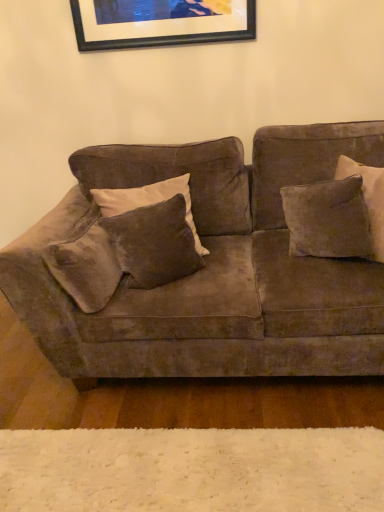
This screenshot has width=384, height=512. What do you see at coordinates (328, 219) in the screenshot? I see `velvet brown pillow at right, which is the first pillow in right-to-left order` at bounding box center [328, 219].

In order to face white fluffy rug at lower center, should I rotate leftwards or rightwards?

It's best to rotate left around 1.515 degrees.

This screenshot has width=384, height=512. Describe the element at coordinates (215, 269) in the screenshot. I see `velvet brown couch at center` at that location.

The width and height of the screenshot is (384, 512). I want to click on velvet brown pillow at center, positioned as the 2th pillow in right-to-left order, so click(x=148, y=201).

In the scene shown: Is velvet brown pillow at center, positioned as the 2th pillow in right-to-left order, to the right of velvet brown couch at center from the viewer's perspective?

No.

Consider the image. Looking at their sizes, would you say velvet brown pillow at center, positioned as the 2th pillow in right-to-left order, is wider or thinner than velvet brown couch at center?

Clearly, velvet brown pillow at center, positioned as the 2th pillow in right-to-left order, has less width compared to velvet brown couch at center.

Which pillow is the 1st one when counting from the back of the velvet brown couch at center? Please provide its 2D coordinates.

[(148, 201)]

Between white fluffy rug at lower center and velvet brown couch at center, which one appears on the right side from the viewer's perspective?

From the viewer's perspective, velvet brown couch at center appears more on the right side.

From a real-world perspective, is white fluffy rug at lower center beneath velvet brown couch at center?

Yes, from a real-world perspective, white fluffy rug at lower center is beneath velvet brown couch at center.

Looking at this image, between white fluffy rug at lower center and velvet brown couch at center, which one has smaller width?

Thinner between the two is velvet brown couch at center.

How many degrees apart are the facing directions of white fluffy rug at lower center and velvet brown couch at center?

The angle between the facing direction of white fluffy rug at lower center and the facing direction of velvet brown couch at center is 89.4 degrees.

From a real-world perspective, which object rests below the other?

velvet brown pillow at right, the 2th pillow when ordered from left to right, from a real-world perspective.

Considering the points (325, 237) and (148, 14), which point is in front, point (325, 237) or point (148, 14)?

The point (325, 237) is more forward.

Is black matte picture frame at upper center smaller than white fluffy rug at lower center?

Yes.

Between black matte picture frame at upper center and white fluffy rug at lower center, which one appears on the right side from the viewer's perspective?

white fluffy rug at lower center is more to the right.

Considering the sizes of black matte picture frame at upper center and white fluffy rug at lower center in the image, is black matte picture frame at upper center taller or shorter than white fluffy rug at lower center?

Clearly, black matte picture frame at upper center is taller compared to white fluffy rug at lower center.

Between point (208, 20) and point (105, 509), which one is positioned in front?

The point (105, 509) is closer.

Is velvet brown couch at center situated inside black matte picture frame at upper center or outside?

velvet brown couch at center is not inside black matte picture frame at upper center, it's outside.

From a real-world perspective, does velvet brown couch at center stand above black matte picture frame at upper center?

No, from a real-world perspective, velvet brown couch at center is not above black matte picture frame at upper center.

In terms of height, does velvet brown couch at center look taller or shorter compared to black matte picture frame at upper center?

Considering their sizes, velvet brown couch at center has more height than black matte picture frame at upper center.

Based on their sizes in the image, would you say velvet brown couch at center is bigger or smaller than black matte picture frame at upper center?

Considering their sizes, velvet brown couch at center takes up more space than black matte picture frame at upper center.

Is white fluffy rug at lower center inside the boundaries of velvet brown pillow at center, the first pillow positioned from the left, or outside?

white fluffy rug at lower center is not inside velvet brown pillow at center, the first pillow positioned from the left, it's outside.

Looking at this image, from a real-world perspective, which object rests below the other?

white fluffy rug at lower center.

Which is more to the left, white fluffy rug at lower center or velvet brown pillow at center, positioned as the 2th pillow in right-to-left order?

velvet brown pillow at center, positioned as the 2th pillow in right-to-left order, is more to the left.

Considering the sizes of velvet brown couch at center and white fluffy rug at lower center in the image, is velvet brown couch at center taller or shorter than white fluffy rug at lower center?

velvet brown couch at center is taller than white fluffy rug at lower center.

Is velvet brown couch at center facing towards white fluffy rug at lower center?

Yes, velvet brown couch at center is turned towards white fluffy rug at lower center.

From the image's perspective, between velvet brown couch at center and white fluffy rug at lower center, which one is located above?

velvet brown couch at center is shown above in the image.

Does point (180, 147) appear closer or farther from the camera than point (55, 476)?

Point (180, 147) is positioned farther from the camera compared to point (55, 476).

Locate an element on the screen. studio couch lying in front of the velvet brown pillow at center, the first pillow positioned from the left is located at coordinates (215, 269).

There is a white fluffy rug at lower center. Where is `studio couch above it (from a real-world perspective)`? This screenshot has height=512, width=384. studio couch above it (from a real-world perspective) is located at coordinates (215, 269).

Based on the photo, which object lies nearer to the anchor point white fluffy rug at lower center, velvet brown pillow at center, positioned as the 2th pillow in right-to-left order, or velvet brown couch at center?

Among the two, velvet brown couch at center is located nearer to white fluffy rug at lower center.

From the image, which object appears to be nearer to black matte picture frame at upper center, velvet brown pillow at right, the 2th pillow when ordered from left to right, or white fluffy rug at lower center?

velvet brown pillow at right, the 2th pillow when ordered from left to right, lies closer to black matte picture frame at upper center than the other object.

From the image, which object appears to be nearer to velvet brown pillow at right, the 2th pillow when ordered from left to right, velvet brown pillow at center, positioned as the 2th pillow in right-to-left order, or black matte picture frame at upper center?

velvet brown pillow at center, positioned as the 2th pillow in right-to-left order, is positioned closer to the anchor velvet brown pillow at right, the 2th pillow when ordered from left to right.

Considering their positions, is velvet brown couch at center positioned further to white fluffy rug at lower center than velvet brown pillow at center, positioned as the 2th pillow in right-to-left order?

The object further to white fluffy rug at lower center is velvet brown pillow at center, positioned as the 2th pillow in right-to-left order.

From the image, which object appears to be farther from velvet brown couch at center, velvet brown pillow at right, the 2th pillow when ordered from left to right, or velvet brown pillow at center, the first pillow positioned from the left?

The object further to velvet brown couch at center is velvet brown pillow at center, the first pillow positioned from the left.

From the image, which object appears to be farther from velvet brown couch at center, black matte picture frame at upper center or velvet brown pillow at center, the first pillow positioned from the left?

Based on the image, black matte picture frame at upper center appears to be further to velvet brown couch at center.

Considering their positions, is velvet brown pillow at center, the first pillow positioned from the left, positioned further to black matte picture frame at upper center than velvet brown pillow at right, the 2th pillow when ordered from left to right?

velvet brown pillow at right, the 2th pillow when ordered from left to right, is further to black matte picture frame at upper center.

When comparing their distances from velvet brown pillow at right, the 2th pillow when ordered from left to right, does velvet brown couch at center or white fluffy rug at lower center seem further?

white fluffy rug at lower center lies further to velvet brown pillow at right, the 2th pillow when ordered from left to right, than the other object.

At what (x,y) coordinates should I click in order to perform the action: click on studio couch between velvet brown pillow at center, positioned as the 2th pillow in right-to-left order, and white fluffy rug at lower center, in the vertical direction. Please return your answer as a coordinate pair (x, y). The width and height of the screenshot is (384, 512). Looking at the image, I should click on (215, 269).

I want to click on studio couch located between velvet brown pillow at center, positioned as the 2th pillow in right-to-left order, and velvet brown pillow at right, the 2th pillow when ordered from left to right, in the left-right direction, so 215,269.

Identify the location of pillow between velvet brown pillow at right, the 2th pillow when ordered from left to right, and white fluffy rug at lower center, in the vertical direction. (148, 201).

The width and height of the screenshot is (384, 512). What are the coordinates of `pillow between black matte picture frame at upper center and velvet brown pillow at center, the first pillow positioned from the left, vertically` in the screenshot? It's located at (328, 219).